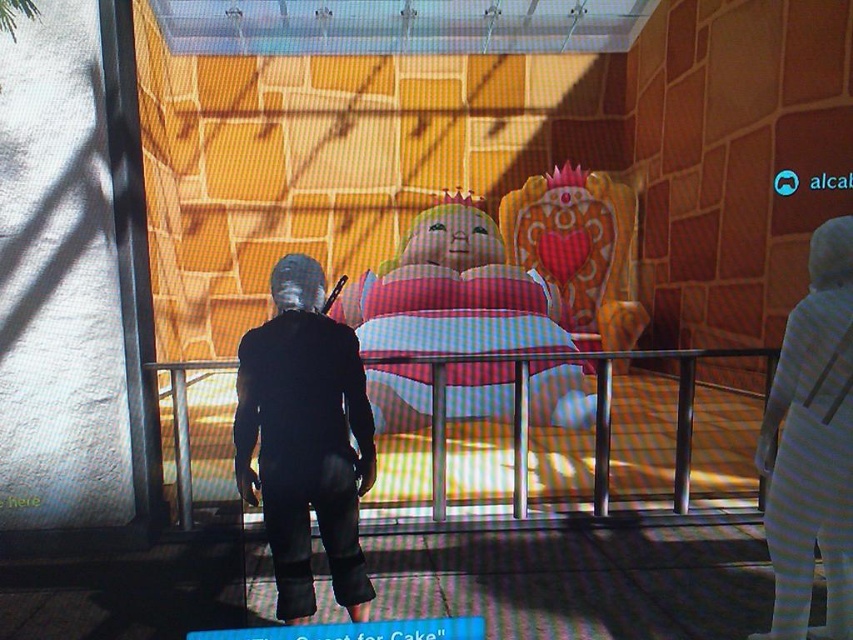
You are a game developer analyzing this scene. The black matte suit at center is represented by point (305, 440). What is the coordinate of the black matte suit at center?

The coordinate of the black matte suit at center is point (305, 440).